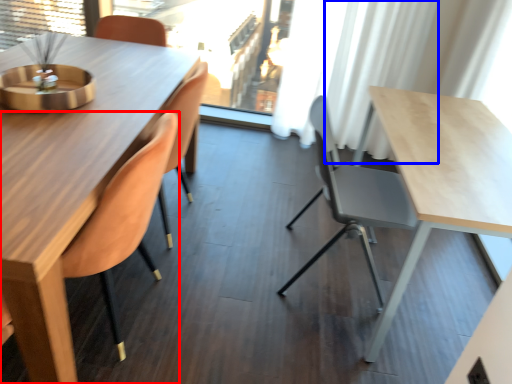
Question: Which of the following is the farthest to the observer, chair (highlighted by a red box) or curtain (highlighted by a blue box)?

Choices:
 (A) chair
 (B) curtain

Answer: (B)